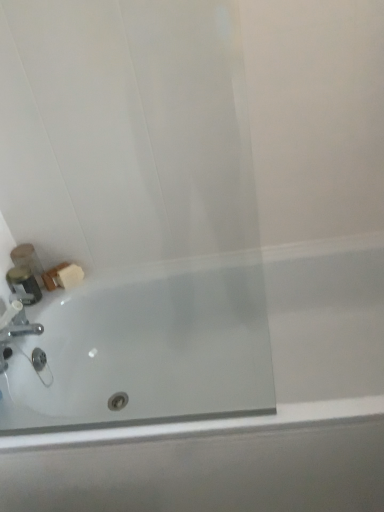
Question: Is metallic silver container at left, the second toiletry positioned from the back, inside the boundaries of silver metallic faucet at lower left, or outside?

Choices:
 (A) outside
 (B) inside

Answer: (A)

Question: In terms of height, does metallic silver container at left, the second toiletry positioned from the back, look taller or shorter compared to silver metallic faucet at lower left?

Choices:
 (A) tall
 (B) short

Answer: (B)

Question: Considering the real-world distances, which object is farthest from the matte plastic soap at lower left, the 1th toiletry in the back-to-front sequence?

Choices:
 (A) white glossy bathtub at lower left
 (B) silver metallic faucet at lower left
 (C) metallic silver container at left, the 1th toiletry when ordered from front to back

Answer: (A)

Question: Based on their relative distances, which object is farther from the silver metallic faucet at lower left?

Choices:
 (A) white glossy bathtub at lower left
 (B) matte plastic soap at lower left, the 1th toiletry in the back-to-front sequence
 (C) metallic silver container at left, the second toiletry positioned from the back

Answer: (A)